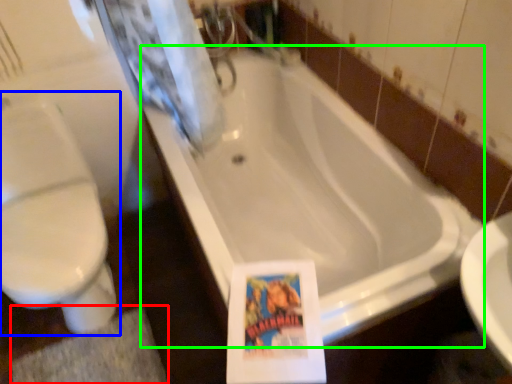
Question: Based on their relative distances, which object is farther from bath mat (highlighted by a red box)? Choose from toilet (highlighted by a blue box) and bathtub (highlighted by a green box).

Choices:
 (A) toilet
 (B) bathtub

Answer: (B)